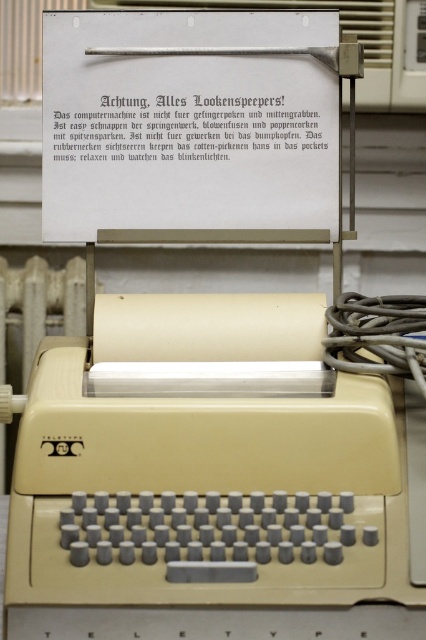
Question: Which object is farther from the camera taking this photo?

Choices:
 (A) beige plastic radiator at lower left
 (B) white paper at upper center

Answer: (A)

Question: Is white paper at upper center smaller than beige plastic radiator at lower left?

Choices:
 (A) no
 (B) yes

Answer: (B)

Question: Which point is closer to the camera?

Choices:
 (A) (8, 456)
 (B) (258, 106)

Answer: (B)

Question: Can you confirm if white paper at upper center is bigger than beige plastic radiator at lower left?

Choices:
 (A) no
 (B) yes

Answer: (A)

Question: Does white paper at upper center have a lesser width compared to beige plastic radiator at lower left?

Choices:
 (A) no
 (B) yes

Answer: (A)